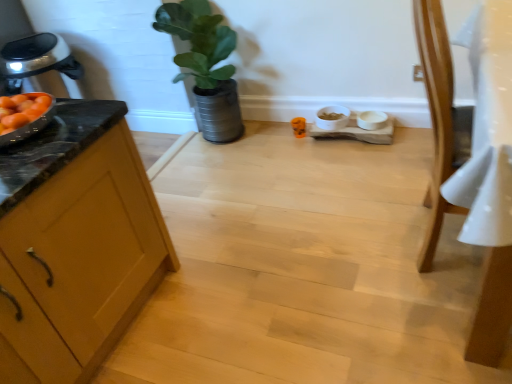
Question: From a real-world perspective, does light brown wooden chair at right sit lower than wooden cabinet at left?

Choices:
 (A) no
 (B) yes

Answer: (A)

Question: Is light brown wooden chair at right facing towards wooden cabinet at left?

Choices:
 (A) no
 (B) yes

Answer: (A)

Question: Can you confirm if light brown wooden chair at right is positioned to the left of wooden cabinet at left?

Choices:
 (A) no
 (B) yes

Answer: (A)

Question: Is light brown wooden chair at right looking in the opposite direction of wooden cabinet at left?

Choices:
 (A) no
 (B) yes

Answer: (A)

Question: Is light brown wooden chair at right thinner than wooden cabinet at left?

Choices:
 (A) yes
 (B) no

Answer: (A)

Question: Considering the positions of wooden cabinet at left and green matte plant at upper center in the image, is wooden cabinet at left taller or shorter than green matte plant at upper center?

Choices:
 (A) tall
 (B) short

Answer: (B)

Question: Considering the positions of wooden cabinet at left and green matte plant at upper center in the image, is wooden cabinet at left wider or thinner than green matte plant at upper center?

Choices:
 (A) wide
 (B) thin

Answer: (A)

Question: From a real-world perspective, is wooden cabinet at left above or below green matte plant at upper center?

Choices:
 (A) above
 (B) below

Answer: (B)

Question: Is wooden cabinet at left bigger or smaller than green matte plant at upper center?

Choices:
 (A) big
 (B) small

Answer: (A)

Question: Is light brown wooden chair at right wider or thinner than green matte plant at upper center?

Choices:
 (A) thin
 (B) wide

Answer: (A)

Question: From a real-world perspective, is light brown wooden chair at right physically located above or below green matte plant at upper center?

Choices:
 (A) below
 (B) above

Answer: (B)

Question: In terms of height, does light brown wooden chair at right look taller or shorter compared to green matte plant at upper center?

Choices:
 (A) short
 (B) tall

Answer: (B)

Question: Is light brown wooden chair at right in front of or behind green matte plant at upper center in the image?

Choices:
 (A) front
 (B) behind

Answer: (A)

Question: From the image's perspective, relative to wooden cabinet at left, is green matte plant at upper center above or below?

Choices:
 (A) above
 (B) below

Answer: (A)

Question: In terms of height, does green matte plant at upper center look taller or shorter compared to wooden cabinet at left?

Choices:
 (A) short
 (B) tall

Answer: (B)